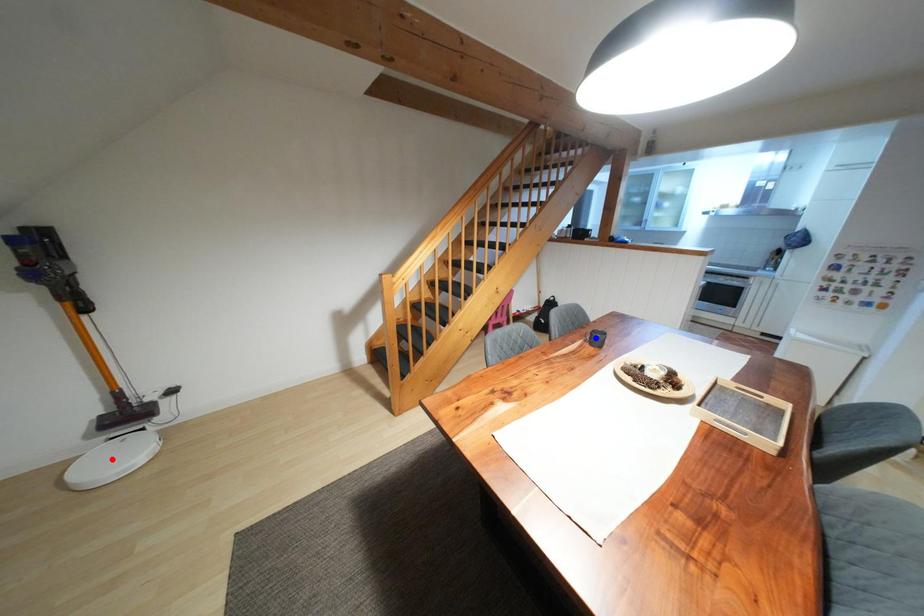
Question: In the image, two points are highlighted. Which point is nearer to the camera? Reply with the corresponding letter.

Choices:
 (A) blue point
 (B) red point

Answer: (B)